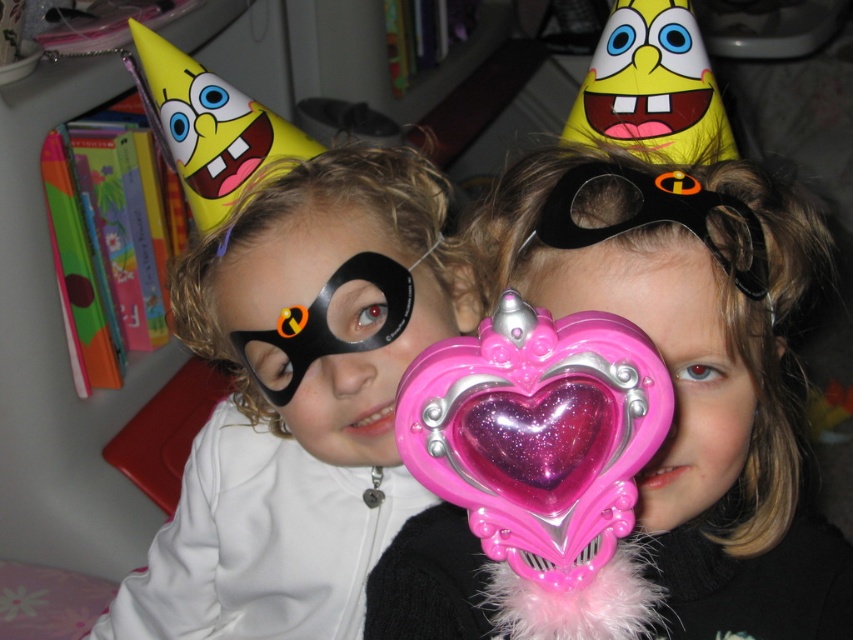
You are taking a photo of two children wearing SpongeBob party hats. You notice two points in the image at coordinates point (x=735, y=237) and point (x=697, y=204). Which point is closer to the camera?

Point (x=735, y=237) is further to the camera than point (x=697, y=204), so the point closer to the camera is point (x=697, y=204).

You are a photographer at the party and want to take a closeup of the pink plastic heart at center. According to the coordinates provided, where should you focus your camera?

You should focus your camera at point 0.577 on the x axis and 0.814 on the y axis to capture the pink plastic heart at center.

You are a photographer trying to capture both the black matte mask at center and the black matte mask at upper center in a single shot. Which mask should you focus on first to ensure both are in focus?

You should focus on the black matte mask at center first because it is closer to the viewer than the black matte mask at upper center, ensuring both are in focus when using depth of field properly.